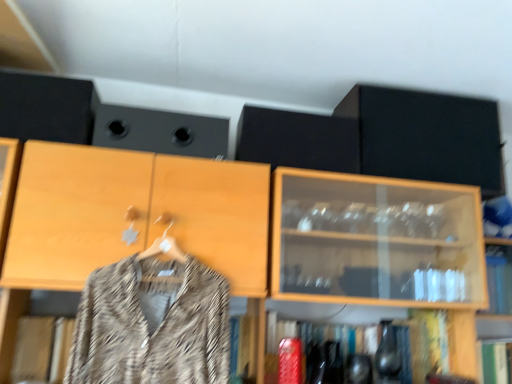
Question: Is shiny metallic vase at lower center turned away from black matte speaker at upper center, positioned as the first speaker in right-to-left order?

Choices:
 (A) no
 (B) yes

Answer: (A)

Question: Is shiny metallic vase at lower center behind black matte speaker at upper center, positioned as the first speaker in right-to-left order?

Choices:
 (A) yes
 (B) no

Answer: (B)

Question: Is shiny metallic vase at lower center with black matte speaker at upper center, positioned as the first speaker in right-to-left order?

Choices:
 (A) yes
 (B) no

Answer: (B)

Question: Can you confirm if shiny metallic vase at lower center is taller than black matte speaker at upper center, which appears as the 2th speaker when viewed from the left?

Choices:
 (A) yes
 (B) no

Answer: (B)

Question: Is shiny metallic vase at lower center thinner than black matte speaker at upper center, positioned as the first speaker in right-to-left order?

Choices:
 (A) yes
 (B) no

Answer: (B)

Question: In terms of height, does black matte speaker at upper center, positioned as the first speaker in right-to-left order, look taller or shorter compared to patterned fabric coat at center?

Choices:
 (A) tall
 (B) short

Answer: (B)

Question: Is black matte speaker at upper center, which appears as the 2th speaker when viewed from the left, spatially inside patterned fabric coat at center, or outside of it?

Choices:
 (A) inside
 (B) outside

Answer: (B)

Question: Is point (314, 125) closer or farther from the camera than point (221, 365)?

Choices:
 (A) closer
 (B) farther

Answer: (B)

Question: Is black matte speaker at upper center, positioned as the first speaker in right-to-left order, wider or thinner than patterned fabric coat at center?

Choices:
 (A) wide
 (B) thin

Answer: (A)

Question: Is point (315, 162) positioned closer to the camera than point (97, 140)?

Choices:
 (A) farther
 (B) closer

Answer: (A)

Question: From a real-world perspective, is black matte speaker at upper center, positioned as the first speaker in right-to-left order, positioned above or below black matte speaker at upper center, which is the second speaker in right-to-left order?

Choices:
 (A) below
 (B) above

Answer: (B)

Question: Is black matte speaker at upper center, positioned as the first speaker in right-to-left order, spatially inside black matte speaker at upper center, which is the second speaker in right-to-left order, or outside of it?

Choices:
 (A) inside
 (B) outside

Answer: (B)

Question: From the image's perspective, is black matte speaker at upper center, which appears as the 2th speaker when viewed from the left, located above or below black matte speaker at upper center, which is the first speaker from left to right?

Choices:
 (A) above
 (B) below

Answer: (B)

Question: Based on their positions, is shiny metallic vase at lower center located to the left or right of black matte cabinet at upper right?

Choices:
 (A) left
 (B) right

Answer: (A)

Question: From the image's perspective, is shiny metallic vase at lower center above or below black matte cabinet at upper right?

Choices:
 (A) below
 (B) above

Answer: (A)